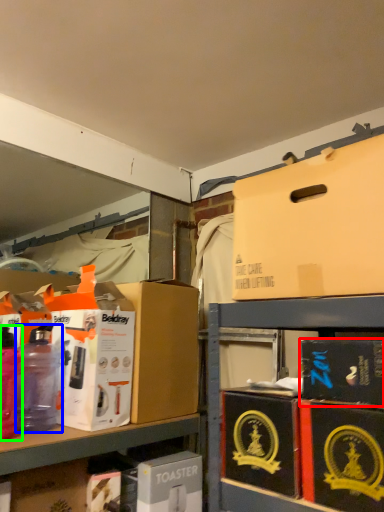
Question: Which object is positioned farthest from box (highlighted by a red box)? Select from bottle (highlighted by a blue box) and bottle (highlighted by a green box).

Choices:
 (A) bottle
 (B) bottle

Answer: (B)